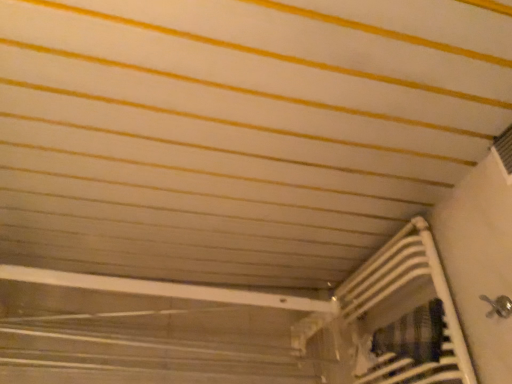
This screenshot has height=384, width=512. What do you see at coordinates (393, 320) in the screenshot?
I see `plaid fabric bunk bed at lower right` at bounding box center [393, 320].

Image resolution: width=512 pixels, height=384 pixels. In order to click on plaid fabric bunk bed at lower right in this screenshot , I will do `click(393, 320)`.

Find the location of a particular element. plaid fabric bunk bed at lower right is located at coordinates (393, 320).